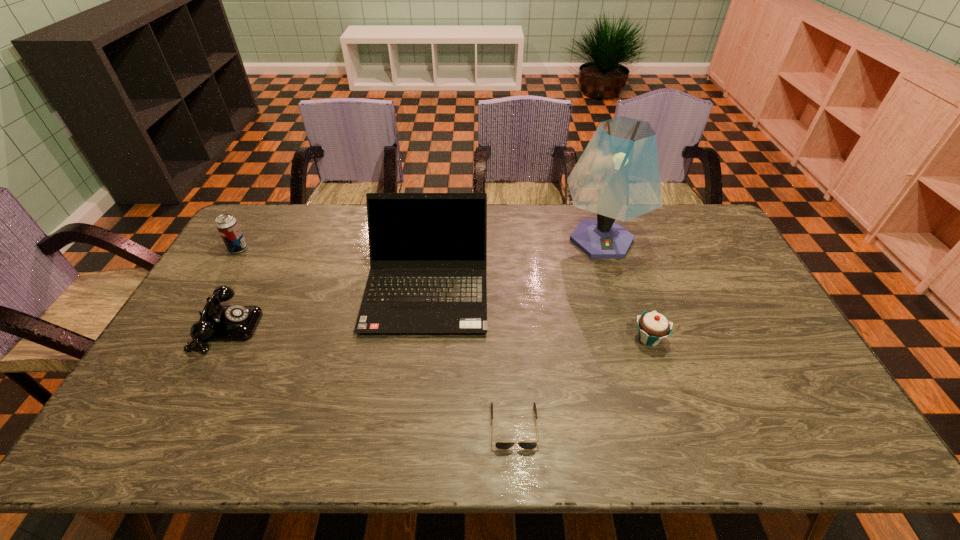
Find the location of a particular element. The image size is (960, 540). the tallest object is located at coordinates (617, 176).

Locate an element on the screen. The width and height of the screenshot is (960, 540). the fifth shortest object is located at coordinates (428, 251).

Where is `laptop computer`? The image size is (960, 540). laptop computer is located at coordinates (428, 251).

At what (x,y) coordinates should I click in order to perform the action: click on beer can. Please return your answer as a coordinate pair (x, y). The width and height of the screenshot is (960, 540). Looking at the image, I should click on (228, 227).

Find the location of a particular element. The width and height of the screenshot is (960, 540). cupcake is located at coordinates (653, 327).

You are a GUI agent. You are given a task and a screenshot of the screen. Output one action in this format:
    pyautogui.click(x=<x>, y=<y>)
    Task: Click on the telephone
    This screenshot has height=540, width=960.
    Given the screenshot: What is the action you would take?
    pyautogui.click(x=217, y=322)

I want to click on sunglasses, so 499,445.

You are a GUI agent. You are given a task and a screenshot of the screen. Output one action in this format:
    pyautogui.click(x=<x>, y=<y>)
    Task: Click on the shortest object
    
    Given the screenshot: What is the action you would take?
    499,445

You are a GUI agent. You are given a task and a screenshot of the screen. Output one action in this format:
    pyautogui.click(x=<x>, y=<y>)
    Task: Click on the vacant space situated 0.350m on the base of the lampshade
    This screenshot has height=540, width=960.
    Given the screenshot: What is the action you would take?
    638,359

Locate an element on the screen. The width and height of the screenshot is (960, 540). vacant space located 0.080m on the screen of the second tallest object is located at coordinates (418, 361).